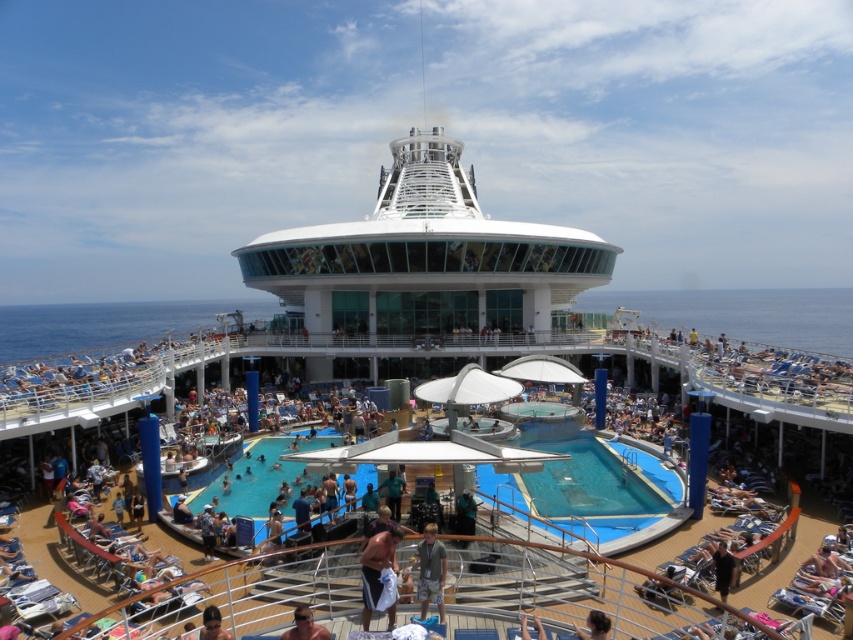
You are a guest on the cruise ship and want to place a new lounge chair between the blue rubber pool at center and the dark brown hair at lower right. Based on their sizes, can you estimate if there will be enough space for the chair?

The blue rubber pool at center might be wider than dark brown hair at lower right, so there may not be enough space for the lounge chair between them.

You are a passenger on the cruise ship and want to take a photo of the blue rubber pool at center and the dark brown hair at lower right. Which object should you zoom in on to capture both in the frame without moving your camera?

You should zoom in on the dark brown hair at lower right because it is smaller in size than the blue rubber pool at center, allowing both to fit within the frame.